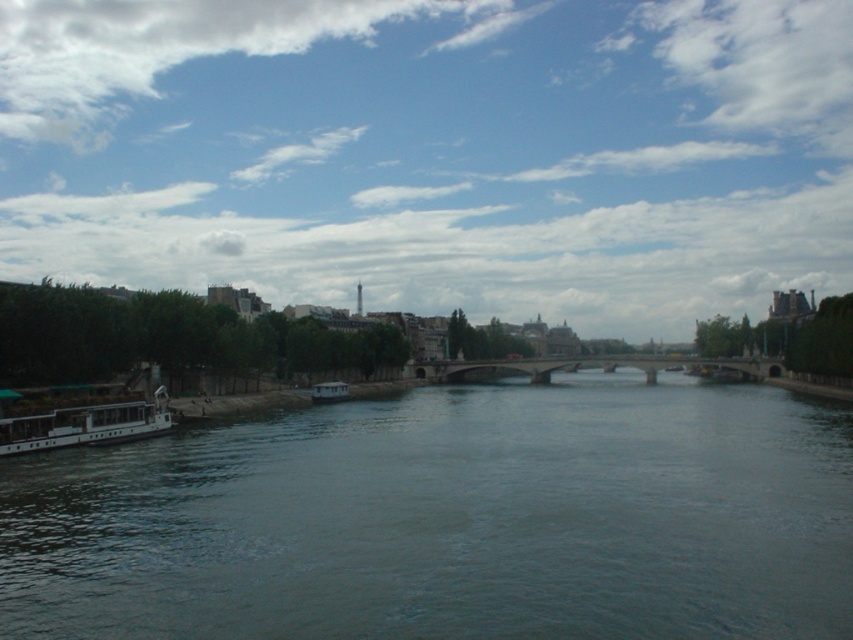
Can you confirm if blue sky at upper center is positioned above white glossy boat at lower left?

Indeed, blue sky at upper center is positioned over white glossy boat at lower left.

What are the coordinates of `blue sky at upper center` in the screenshot? It's located at (434, 150).

Is blue sky at upper center below dark gray water at center?

Incorrect, blue sky at upper center is not positioned below dark gray water at center.

Locate an element on the screen. This screenshot has height=640, width=853. blue sky at upper center is located at coordinates (434, 150).

At what (x,y) coordinates should I click in order to perform the action: click on blue sky at upper center. Please return your answer as a coordinate pair (x, y). Looking at the image, I should click on point(434,150).

Does dark gray water at center appear over white matte boat at center?

Actually, dark gray water at center is below white matte boat at center.

Between point (207, 456) and point (341, 394), which one is positioned in front?

Point (207, 456)

Locate an element on the screen. dark gray water at center is located at coordinates 450,520.